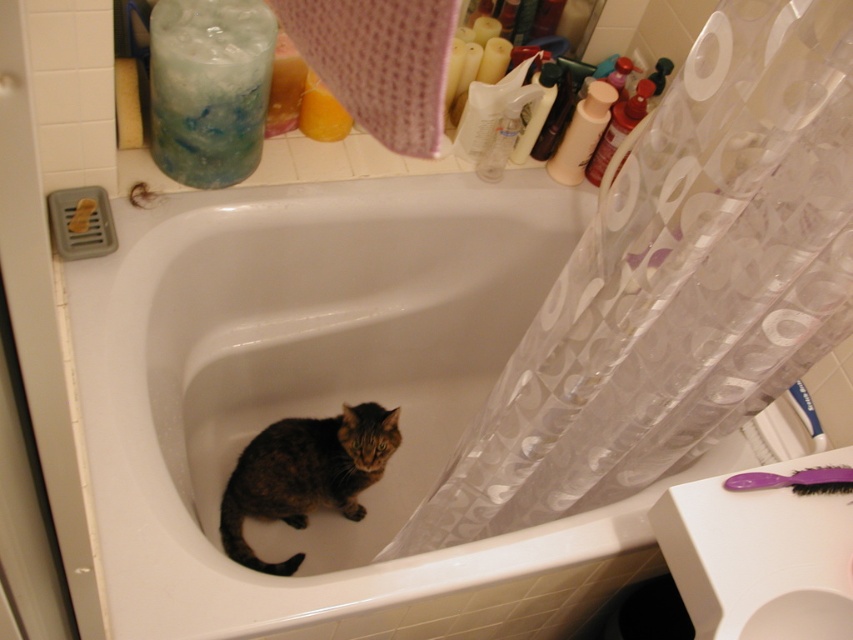
Who is positioned more to the right, clear plastic shower curtain at right or tabby fur cat at center?

clear plastic shower curtain at right is more to the right.

Between clear plastic shower curtain at right and tabby fur cat at center, which one appears on the left side from the viewer's perspective?

tabby fur cat at center

I want to click on clear plastic shower curtain at right, so click(x=677, y=284).

Find the location of a particular element. The height and width of the screenshot is (640, 853). clear plastic shower curtain at right is located at coordinates (677, 284).

Can you confirm if white glossy bathtub at center is thinner than clear plastic shower curtain at right?

Incorrect, white glossy bathtub at center's width is not less than clear plastic shower curtain at right's.

Does white glossy bathtub at center have a greater width compared to clear plastic shower curtain at right?

Yes.

Is point (91, 300) behind point (468, 477)?

Yes, it is.

The height and width of the screenshot is (640, 853). I want to click on white glossy bathtub at center, so click(328, 403).

Where is `white glossy bathtub at center`? The height and width of the screenshot is (640, 853). white glossy bathtub at center is located at coordinates (328, 403).

The image size is (853, 640). Find the location of `white glossy bathtub at center`. white glossy bathtub at center is located at coordinates (328, 403).

Locate an element on the screen. This screenshot has width=853, height=640. white glossy bathtub at center is located at coordinates (328, 403).